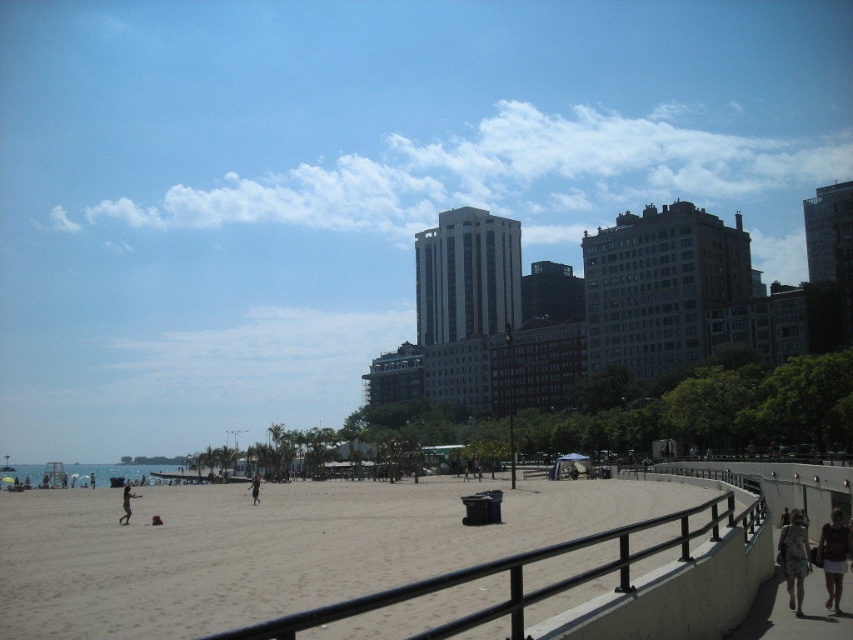
Question: Estimate the real-world distances between objects in this image. Which object is farther from the light brown sand at lower center?

Choices:
 (A) denim shorts at lower right
 (B) transparent blue sky at upper center
 (C) dark blue fabric person at center

Answer: (B)

Question: Is light brown sand at lower center smaller than dark blue fabric person at center?

Choices:
 (A) no
 (B) yes

Answer: (A)

Question: Is the position of light brown sand at lower center more distant than that of denim shorts at lower right?

Choices:
 (A) yes
 (B) no

Answer: (B)

Question: Based on their relative distances, which object is nearer to the transparent blue sky at upper center?

Choices:
 (A) floral-patterned shirt at lower right
 (B) denim shorts at lower right
 (C) dark blue fabric person at center
 (D) light brown sand at lower center

Answer: (D)

Question: Is floral-patterned shirt at lower right thinner than skinny jeans at center?

Choices:
 (A) yes
 (B) no

Answer: (A)

Question: Which point appears closest to the camera in this image?

Choices:
 (A) (834, 582)
 (B) (401, 566)
 (C) (793, 556)

Answer: (A)